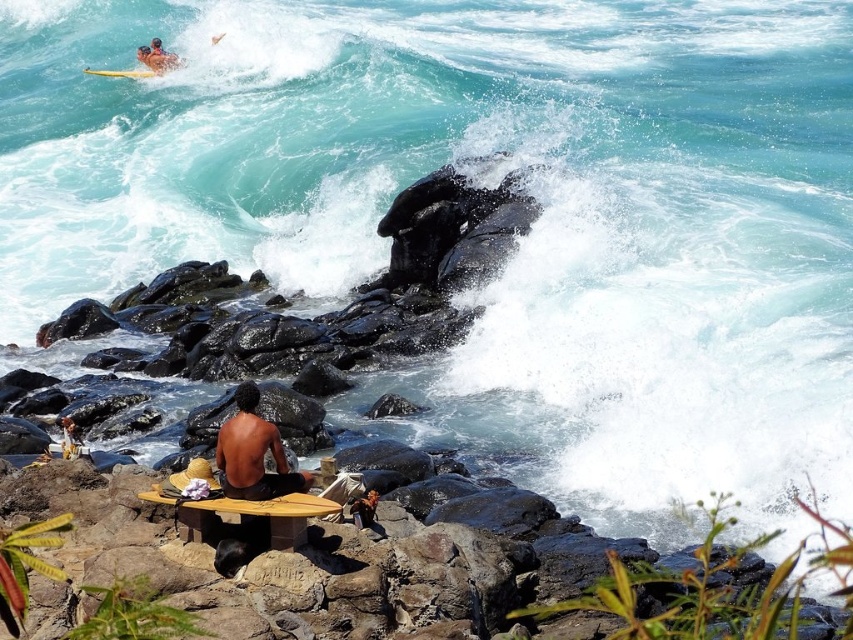
Does shiny black skin at center appear on the left side of yellow foam surfboard at upper left?

Incorrect, shiny black skin at center is not on the left side of yellow foam surfboard at upper left.

Which is below, shiny black skin at center or yellow foam surfboard at upper left?

shiny black skin at center is below.

Measure the distance between shiny black skin at center and camera.

shiny black skin at center and camera are 90.76 feet apart.

Identify the location of shiny black skin at center. The image size is (853, 640). (253, 452).

Is point (262, 461) closer to camera compared to point (282, 508)?

No, it is not.

Is shiny black skin at center behind wooden surfboard at lower center?

That is True.

The image size is (853, 640). What do you see at coordinates (253, 452) in the screenshot?
I see `shiny black skin at center` at bounding box center [253, 452].

Where is `shiny black skin at center`? This screenshot has height=640, width=853. shiny black skin at center is located at coordinates (253, 452).

Between wooden surfboard at lower center and yellow foam surfboard at upper left, which one appears on the right side from the viewer's perspective?

From the viewer's perspective, wooden surfboard at lower center appears more on the right side.

Does wooden surfboard at lower center have a lesser width compared to yellow foam surfboard at upper left?

Correct, wooden surfboard at lower center's width is less than yellow foam surfboard at upper left's.

Does point (306, 509) come in front of point (154, 72)?

Yes, it is.

This screenshot has width=853, height=640. I want to click on wooden surfboard at lower center, so click(252, 504).